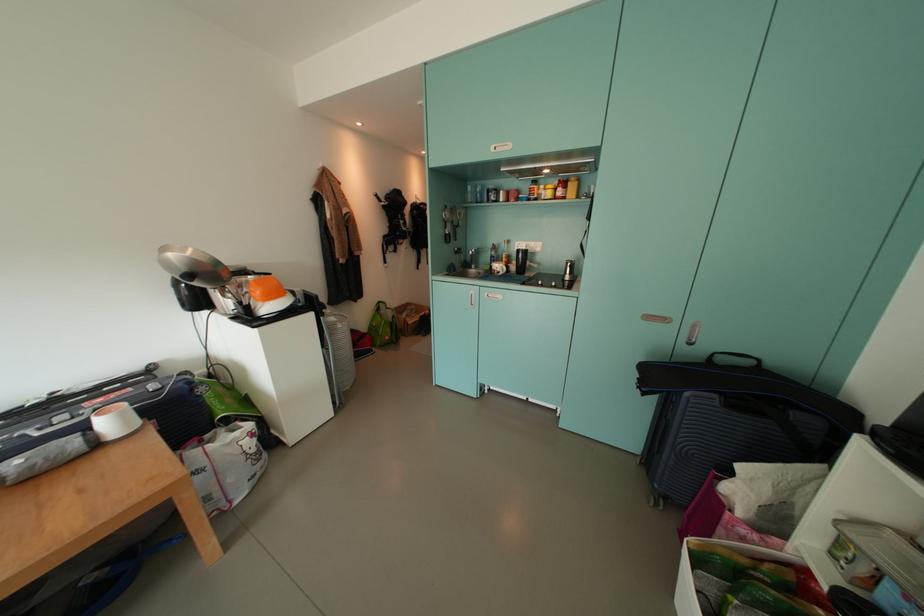
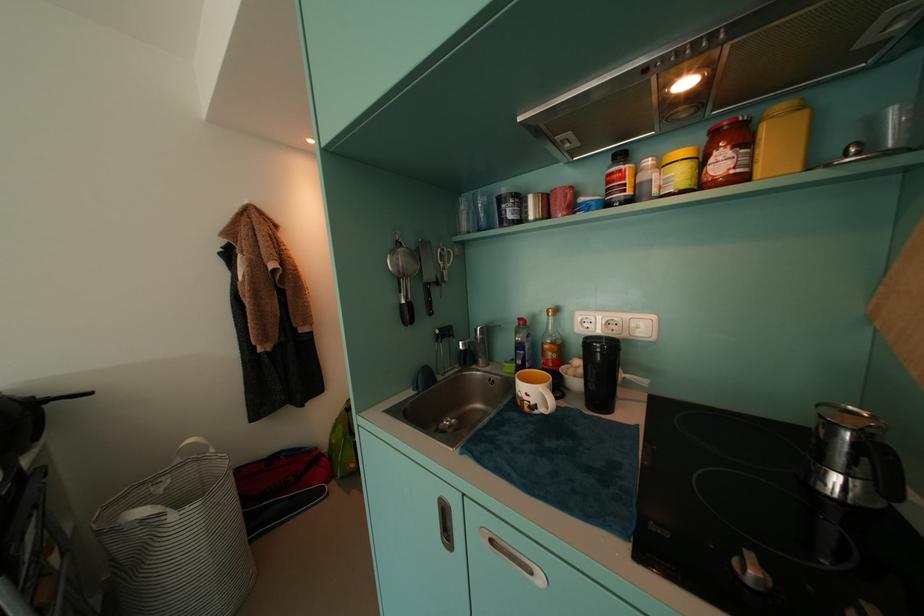
Find the pixel in the second image that matches the point at 480,270 in the first image.

(488, 363)